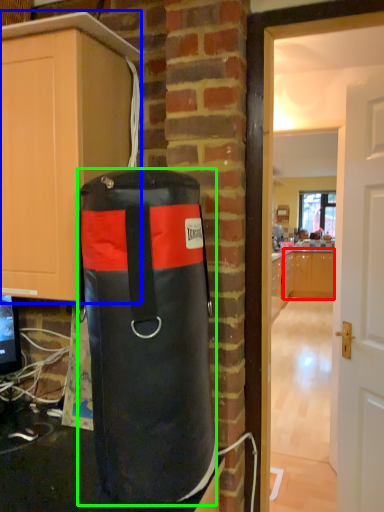
Question: Which is farther away from cabinetry (highlighted by a red box)? cabinetry (highlighted by a blue box) or punching bag (highlighted by a green box)?

Choices:
 (A) cabinetry
 (B) punching bag

Answer: (B)